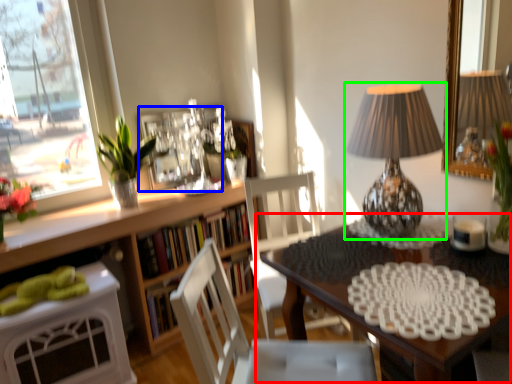
Question: Considering the real-world distances, which object is closest to table (highlighted by a red box)? picture frame (highlighted by a blue box) or lamp (highlighted by a green box).

Choices:
 (A) picture frame
 (B) lamp

Answer: (B)